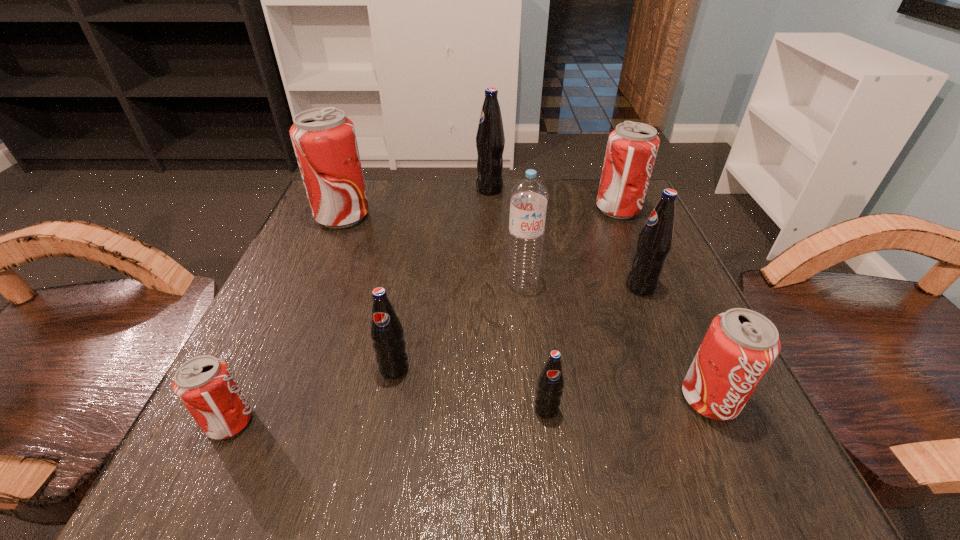
The width and height of the screenshot is (960, 540). Find the location of `the smallest pink soda can`. the smallest pink soda can is located at coordinates (205, 385).

The height and width of the screenshot is (540, 960). What are the coordinates of `the nearest black pop` in the screenshot? It's located at (550, 383).

Where is `the third black pop from left to right`? This screenshot has width=960, height=540. the third black pop from left to right is located at coordinates (550, 383).

The height and width of the screenshot is (540, 960). In order to click on vacant region located 0.220m on the front label of the farthest object in this screenshot , I will do `click(384, 189)`.

You are a GUI agent. You are given a task and a screenshot of the screen. Output one action in this format:
    pyautogui.click(x=<x>, y=<y>)
    Task: Click on the free spot located 0.120m on the front label of the farthest object
    This screenshot has height=540, width=960.
    Given the screenshot: What is the action you would take?
    pyautogui.click(x=425, y=189)

The width and height of the screenshot is (960, 540). Identify the location of blank space located on the front label of the farthest object. (325, 189).

This screenshot has height=540, width=960. I want to click on free spot located on the front of the biggest pink soda can, so click(285, 350).

Where is `free space located 0.100m on the left of the water bottle`? free space located 0.100m on the left of the water bottle is located at coordinates (451, 282).

This screenshot has width=960, height=540. What are the coordinates of `vacant space situated 0.330m on the front of the second biggest pink soda can` in the screenshot? It's located at (674, 336).

In order to click on vacant space located on the front label of the rightmost black pop in this screenshot , I will do `click(415, 287)`.